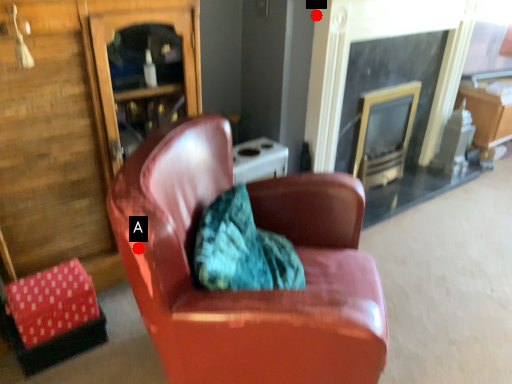
Question: Two points are circled on the image, labeled by A and B beside each circle. Which of the following is the closest to the observer?

Choices:
 (A) A is closer
 (B) B is closer

Answer: (A)